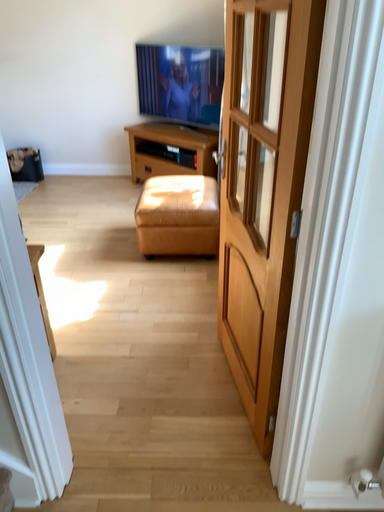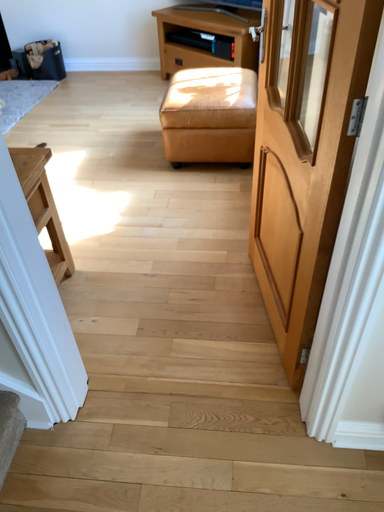
Question: Which way did the camera rotate in the video?

Choices:
 (A) rotated downward
 (B) rotated upward

Answer: (A)